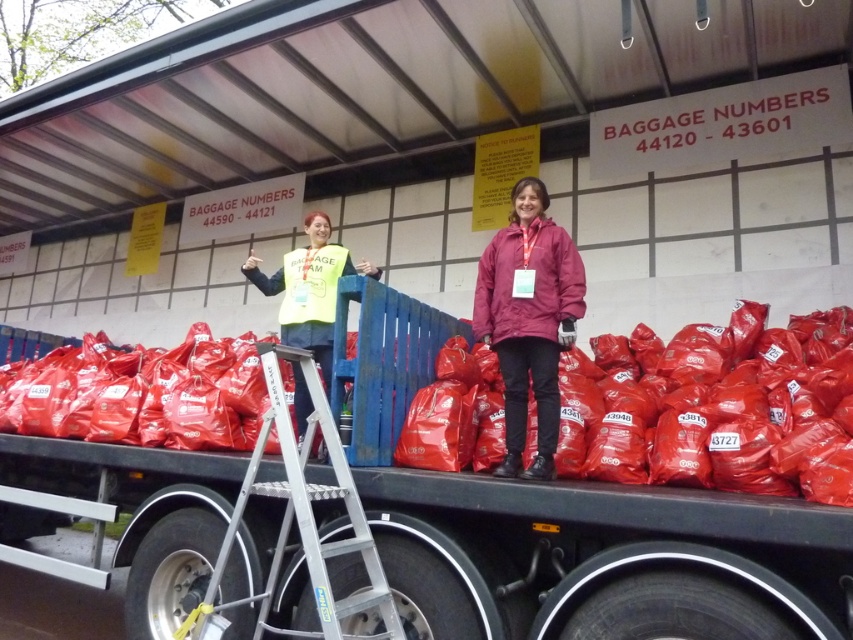
Question: Is rubberized plastic bags at center to the left of silver/aluminum ladder at center from the viewer's perspective?

Choices:
 (A) no
 (B) yes

Answer: (B)

Question: Is rubberized plastic bags at center to the left of silver/aluminum ladder at center from the viewer's perspective?

Choices:
 (A) no
 (B) yes

Answer: (B)

Question: Does silver/aluminum ladder at center have a greater width compared to yellow reflective vest at center?

Choices:
 (A) yes
 (B) no

Answer: (A)

Question: Which point is farther from the camera taking this photo?

Choices:
 (A) (262, 604)
 (B) (508, 236)
 (C) (289, 413)
 (D) (294, 307)

Answer: (D)

Question: Which point is closer to the camera taking this photo?

Choices:
 (A) [x=329, y=592]
 (B) [x=328, y=289]

Answer: (A)

Question: Which point is farther to the camera?

Choices:
 (A) (276, 280)
 (B) (339, 456)

Answer: (A)